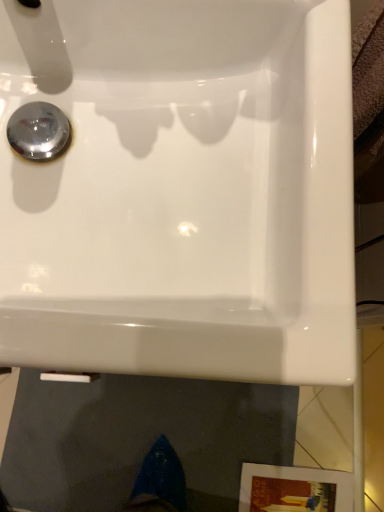
The width and height of the screenshot is (384, 512). What do you see at coordinates (181, 190) in the screenshot?
I see `white glossy sink at upper center` at bounding box center [181, 190].

Where is `white glossy sink at upper center`? white glossy sink at upper center is located at coordinates (181, 190).

The height and width of the screenshot is (512, 384). In order to click on white glossy sink at upper center in this screenshot , I will do pos(181,190).